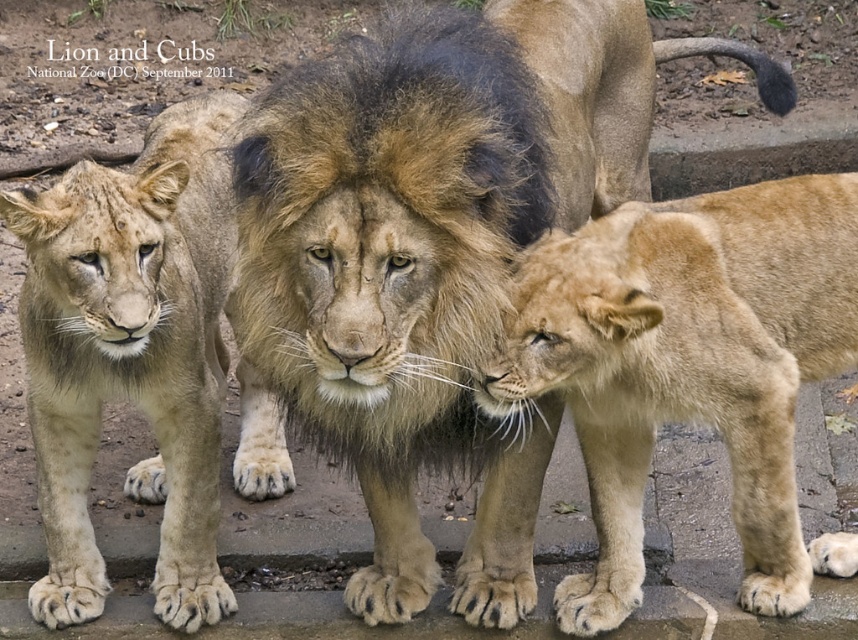
Question: Which object appears closest to the camera in this image?

Choices:
 (A) golden fur lion cub at lower right
 (B) golden fur lion at center

Answer: (B)

Question: Estimate the real-world distances between objects in this image. Which object is closer to the golden fur lion at center?

Choices:
 (A) golden fur lion cub at lower right
 (B) light brown fur at center

Answer: (A)

Question: Does golden fur lion at center have a larger size compared to golden fur lion cub at lower right?

Choices:
 (A) yes
 (B) no

Answer: (A)

Question: Does golden fur lion cub at lower right have a lesser width compared to light brown fur at center?

Choices:
 (A) yes
 (B) no

Answer: (B)

Question: Estimate the real-world distances between objects in this image. Which object is closer to the golden fur lion cub at lower right?

Choices:
 (A) golden fur lion at center
 (B) light brown fur at center

Answer: (A)

Question: Is golden fur lion cub at lower right smaller than light brown fur at center?

Choices:
 (A) no
 (B) yes

Answer: (B)